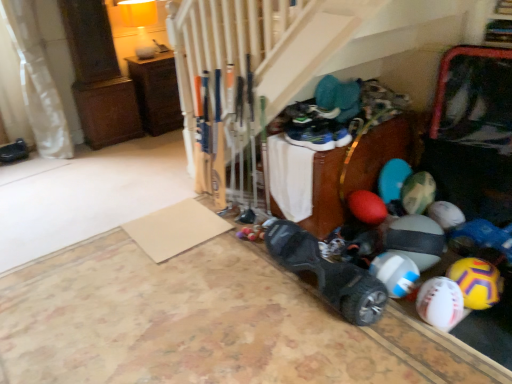
Question: From the image's perspective, is black matte shoe at left, the 3th footwear ordered from the bottom, over white fabric curtain at left?

Choices:
 (A) yes
 (B) no

Answer: (B)

Question: From a real-world perspective, is black matte shoe at left, the third footwear viewed from the right, below white fabric curtain at left?

Choices:
 (A) yes
 (B) no

Answer: (A)

Question: Is black matte shoe at left, the third footwear viewed from the right, not inside white fabric curtain at left?

Choices:
 (A) no
 (B) yes

Answer: (B)

Question: From a real-world perspective, is black matte shoe at left, the third footwear viewed from the right, physically above white fabric curtain at left?

Choices:
 (A) no
 (B) yes

Answer: (A)

Question: Is there a large distance between black matte shoe at left, marked as the 3th footwear in a front-to-back arrangement, and white fabric curtain at left?

Choices:
 (A) no
 (B) yes

Answer: (A)

Question: Is brown wood cabinet at upper left inside the boundaries of blue rubber beach ball at lower right, placed as the third beach ball when sorted from right to left, or outside?

Choices:
 (A) outside
 (B) inside

Answer: (A)

Question: Is brown wood cabinet at upper left in front of or behind blue rubber beach ball at lower right, which is the 1th beach ball from left to right, in the image?

Choices:
 (A) front
 (B) behind

Answer: (B)

Question: From the image's perspective, relative to blue rubber beach ball at lower right, placed as the third beach ball when sorted from right to left, is brown wood cabinet at upper left above or below?

Choices:
 (A) above
 (B) below

Answer: (A)

Question: Is point (166, 77) closer or farther from the camera than point (394, 254)?

Choices:
 (A) farther
 (B) closer

Answer: (A)

Question: From the image's perspective, relative to blue rubber beach ball at lower right, placed as the third beach ball when sorted from right to left, is yellow matte beach ball at lower right, the 3th beach ball in the left-to-right sequence, above or below?

Choices:
 (A) above
 (B) below

Answer: (B)

Question: Is point (465, 291) positioned closer to the camera than point (398, 264)?

Choices:
 (A) farther
 (B) closer

Answer: (B)

Question: Based on their positions, is yellow matte beach ball at lower right, the 3th beach ball in the left-to-right sequence, located to the left or right of blue rubber beach ball at lower right, which is the 1th beach ball from left to right?

Choices:
 (A) left
 (B) right

Answer: (B)

Question: Choose the correct answer: Is yellow matte beach ball at lower right, the 3th beach ball in the left-to-right sequence, inside blue rubber beach ball at lower right, placed as the third beach ball when sorted from right to left, or outside it?

Choices:
 (A) inside
 (B) outside

Answer: (B)

Question: Considering the relative positions of white fabric curtain at left and yellow matte beach ball at lower right, which is counted as the 1th beach ball, starting from the right, in the image provided, is white fabric curtain at left to the left or to the right of yellow matte beach ball at lower right, which is counted as the 1th beach ball, starting from the right,?

Choices:
 (A) right
 (B) left

Answer: (B)

Question: In terms of width, does white fabric curtain at left look wider or thinner when compared to yellow matte beach ball at lower right, which is counted as the 1th beach ball, starting from the right?

Choices:
 (A) thin
 (B) wide

Answer: (B)